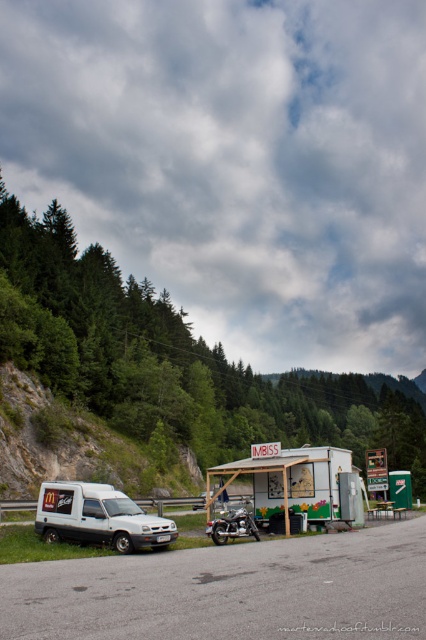
Question: Estimate the real-world distances between objects in this image. Which object is closer to the green painted wood food stall at center?

Choices:
 (A) gray asphalt road at center
 (B) white matte van at center
 (C) white matte van at lower left

Answer: (C)

Question: Is shiny chrome motorcycle at center below white matte van at center?

Choices:
 (A) no
 (B) yes

Answer: (A)

Question: Does white matte van at lower left have a larger size compared to shiny chrome motorcycle at center?

Choices:
 (A) yes
 (B) no

Answer: (B)

Question: Based on their relative distances, which object is nearer to the gray asphalt road at center?

Choices:
 (A) white matte van at center
 (B) shiny chrome motorcycle at center
 (C) green painted wood food stall at center
 (D) white matte van at lower left

Answer: (D)

Question: Is gray asphalt road at center further to camera compared to shiny chrome motorcycle at center?

Choices:
 (A) yes
 (B) no

Answer: (B)

Question: Which point appears closest to the camera in this image?

Choices:
 (A) (x=114, y=509)
 (B) (x=201, y=504)
 (C) (x=250, y=520)

Answer: (A)